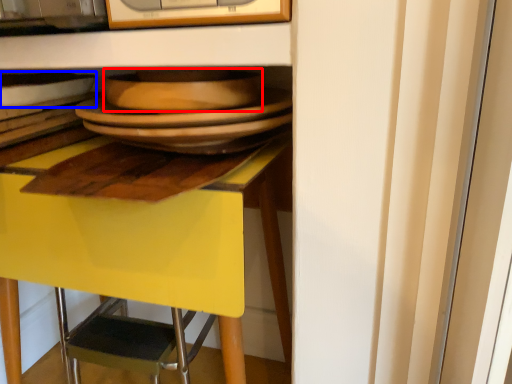
Question: Among these objects, which one is nearest to the camera, platter (highlighted by a red box) or tableware (highlighted by a blue box)?

Choices:
 (A) platter
 (B) tableware

Answer: (A)